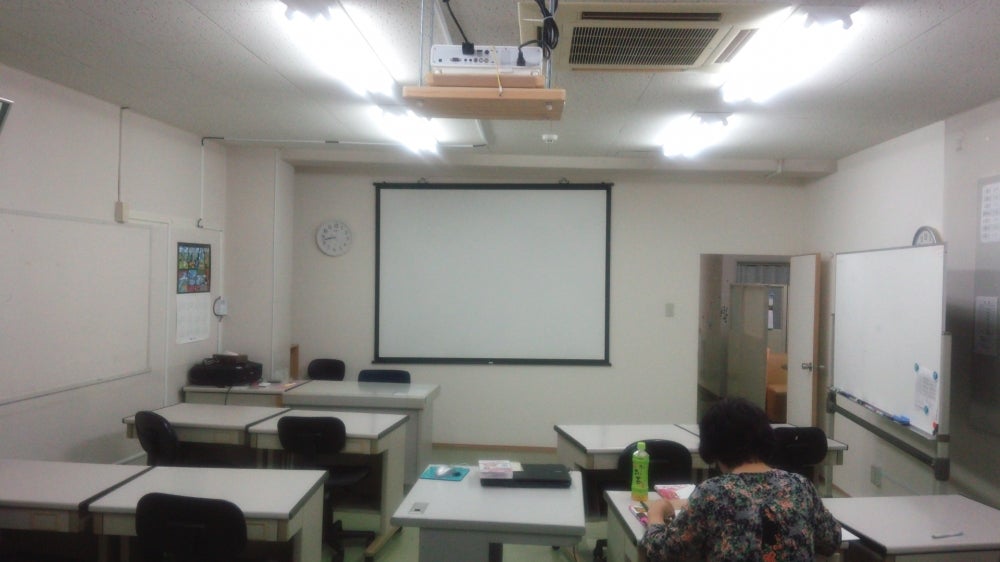
Locate an element on the screen. hall is located at coordinates (757, 285), (735, 337), (716, 287), (767, 326), (772, 406).